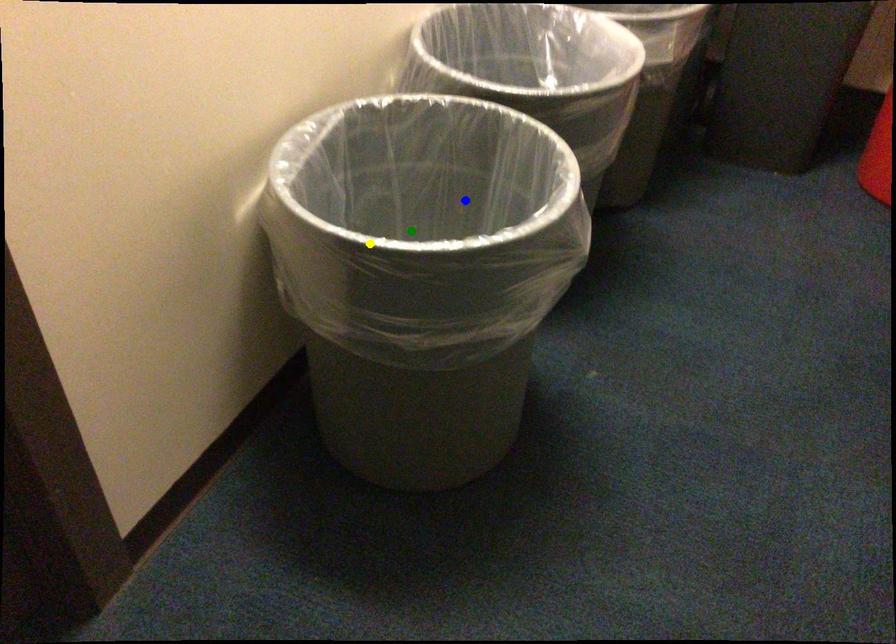
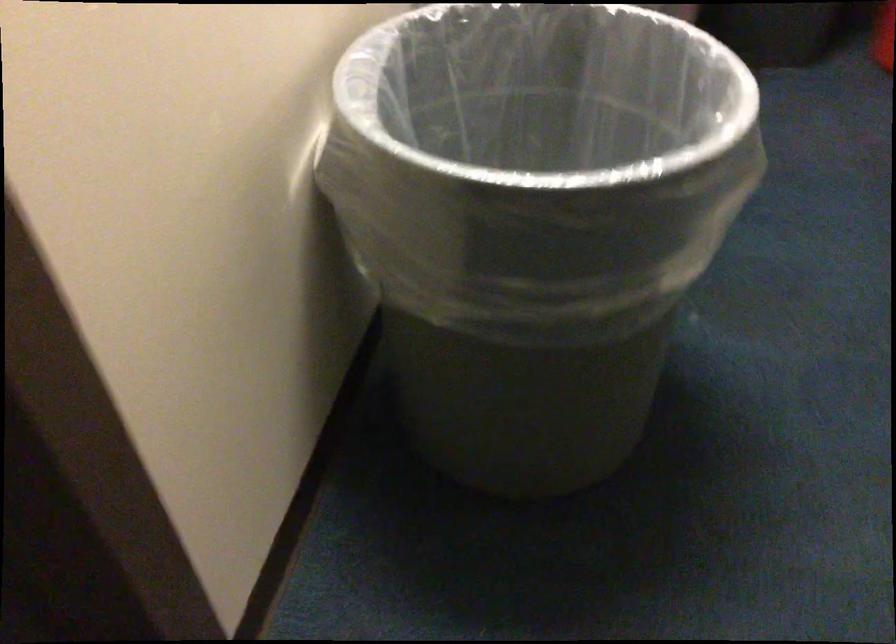
I am providing you with two images of the same scene from different viewpoints. Three points are marked in image1. Which point corresponds to a part or object that is occluded in image2?In image1, three points are marked. Which of them correspond to a part or object that is occluded in image2?Among the three points shown in image1, which one corresponds to a part or object that is no longer visible due to occlusion in image2?

green point